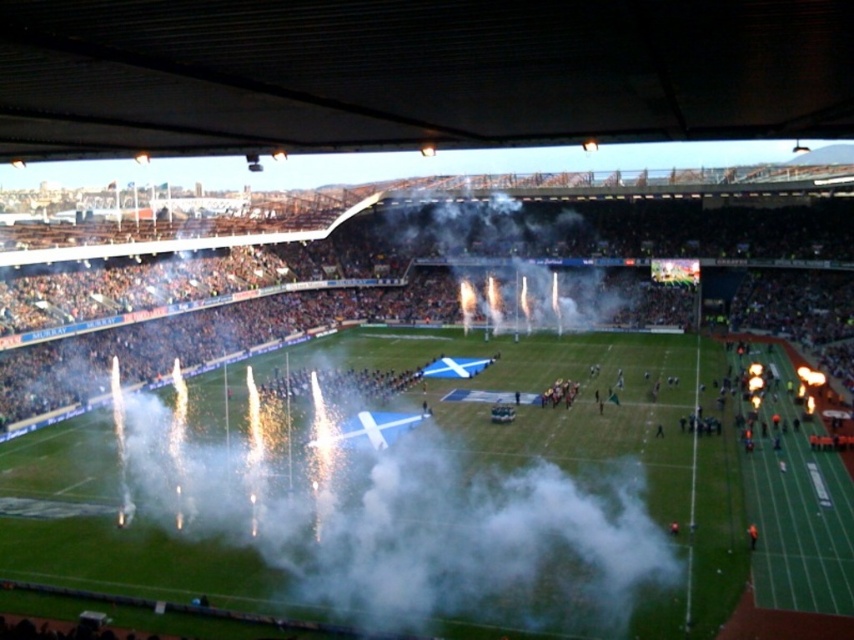
Does white fog at center have a greater height compared to white smoke at center?

Incorrect, white fog at center's height is not larger of white smoke at center's.

Which is more to the left, white fog at center or white smoke at center?

white fog at center

Does point (601, 544) come closer to viewer compared to point (509, 316)?

Yes.

This screenshot has width=854, height=640. What are the coordinates of `white fog at center` in the screenshot? It's located at tap(408, 524).